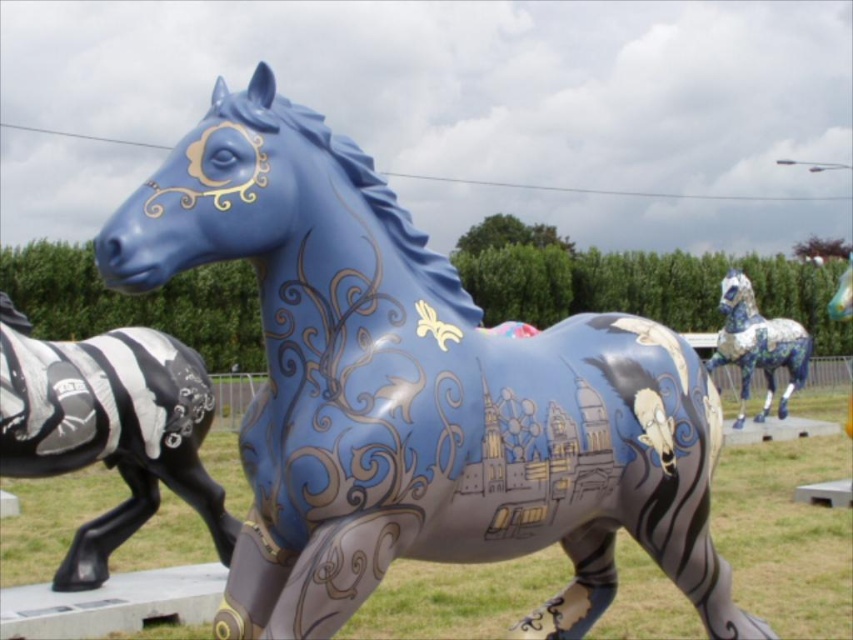
Between glossy blue horse at center and metallic silver zebra at left, which one is positioned higher?

glossy blue horse at center is higher up.

Is glossy blue horse at center thinner than metallic silver zebra at left?

Incorrect, glossy blue horse at center's width is not less than metallic silver zebra at left's.

Is point (317, 429) more distant than point (73, 568)?

That is False.

This screenshot has height=640, width=853. In order to click on glossy blue horse at center in this screenshot , I will do `click(416, 394)`.

Looking at this image, is glossy blue horse at center above porcelain mosaic horse at right?

Yes, glossy blue horse at center is above porcelain mosaic horse at right.

Does glossy blue horse at center appear under porcelain mosaic horse at right?

No, glossy blue horse at center is not below porcelain mosaic horse at right.

Describe the element at coordinates (416, 394) in the screenshot. I see `glossy blue horse at center` at that location.

The image size is (853, 640). Identify the location of glossy blue horse at center. (416, 394).

Consider the image. Is metallic silver zebra at left above porcelain mosaic horse at right?

Actually, metallic silver zebra at left is below porcelain mosaic horse at right.

What do you see at coordinates (108, 429) in the screenshot? The height and width of the screenshot is (640, 853). I see `metallic silver zebra at left` at bounding box center [108, 429].

Where is `metallic silver zebra at left`? This screenshot has height=640, width=853. metallic silver zebra at left is located at coordinates (108, 429).